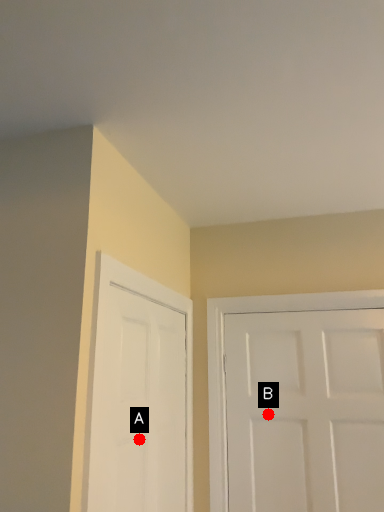
Question: Two points are circled on the image, labeled by A and B beside each circle. Which point appears closest to the camera in this image?

Choices:
 (A) A is closer
 (B) B is closer

Answer: (A)